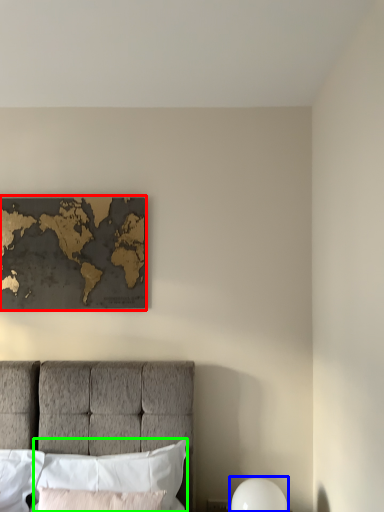
Question: Which object is the farthest from picture frame (highlighted by a red box)? Choose among these: bedside lamp (highlighted by a blue box) or pillow (highlighted by a green box).

Choices:
 (A) bedside lamp
 (B) pillow

Answer: (A)